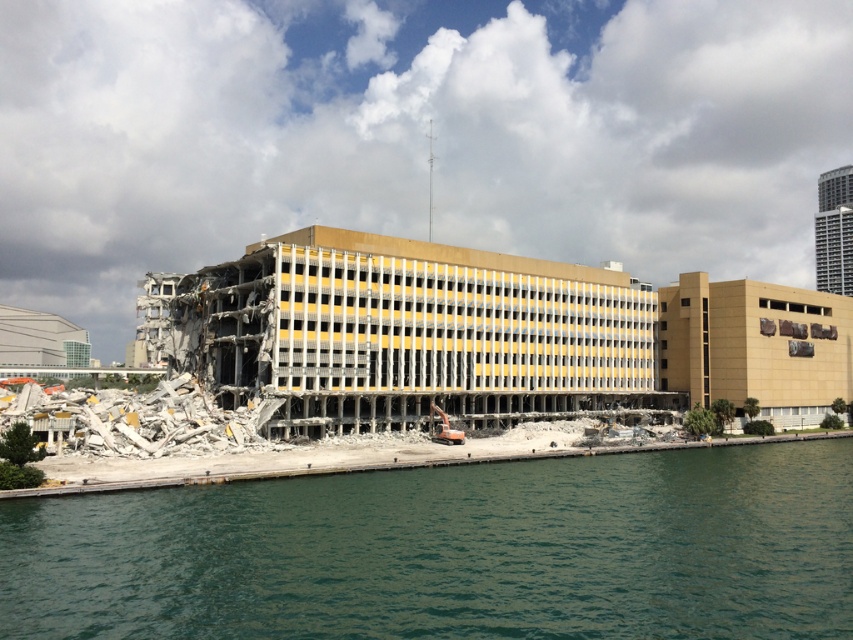
You are a safety inspector standing at the edge of the construction site. You need to check the distance between the green water at lower left and the concrete rubble at center. Which one is closer to you?

The green water at lower left is closer to the viewer than the concrete rubble at center.

From the picture: You are a construction worker assessing the demolition site. You notice the green water at lower left and the concrete rubble at center. Which object is taller?

The concrete rubble at center is taller than the green water at lower left.

You are a construction worker assessing the demolition site. You see the green water at lower left and the concrete rubble at center. Which area has a larger surface area?

The concrete rubble at center has a larger surface area than the green water at lower left.